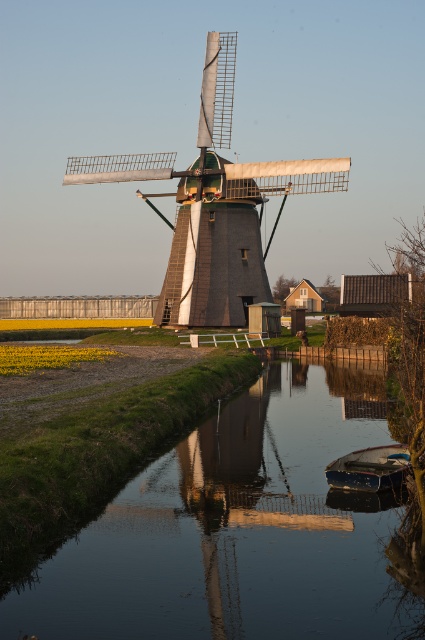
Question: Considering the real-world distances, which object is closest to the blue wooden boat at lower right?

Choices:
 (A) wooden windmill at center
 (B) smooth reflective water at center

Answer: (B)

Question: Does smooth reflective water at center appear on the left side of blue wooden boat at lower right?

Choices:
 (A) no
 (B) yes

Answer: (B)

Question: Which is farther from the wooden windmill at center?

Choices:
 (A) blue wooden boat at lower right
 (B) smooth reflective water at center

Answer: (A)

Question: Can you confirm if wooden windmill at center is smaller than blue wooden boat at lower right?

Choices:
 (A) yes
 (B) no

Answer: (B)

Question: Which object is the farthest from the smooth reflective water at center?

Choices:
 (A) blue wooden boat at lower right
 (B) wooden windmill at center

Answer: (B)

Question: Considering the relative positions of wooden windmill at center and blue wooden boat at lower right in the image provided, where is wooden windmill at center located with respect to blue wooden boat at lower right?

Choices:
 (A) above
 (B) below

Answer: (A)